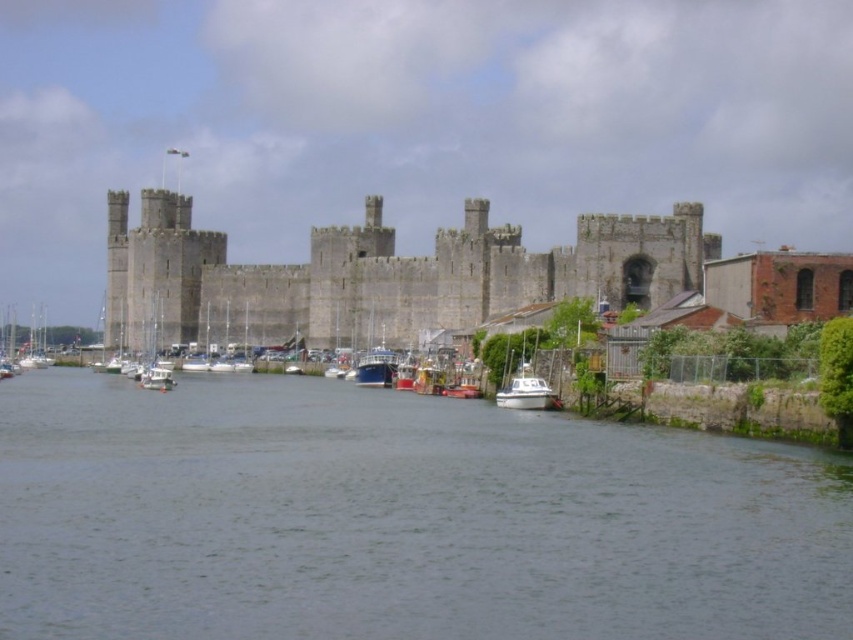
Question: Where is gray stone castle at center located in relation to white glossy boat at lower right in the image?

Choices:
 (A) right
 (B) left

Answer: (B)

Question: Can you confirm if gray stone castle at center is bigger than white glossy boat at lower right?

Choices:
 (A) no
 (B) yes

Answer: (B)

Question: Can you confirm if gray stone castle at center is positioned below white glossy boat at lower right?

Choices:
 (A) yes
 (B) no

Answer: (B)

Question: Which point is farther from the camera taking this photo?

Choices:
 (A) (616, 465)
 (B) (370, 211)

Answer: (B)

Question: Which object appears closest to the camera in this image?

Choices:
 (A) gray stone castle at center
 (B) white matte sailboat at left
 (C) white glossy boat at lower right

Answer: (C)

Question: Estimate the real-world distances between objects in this image. Which object is farther from the gray stone castle at center?

Choices:
 (A) gray concrete water at lower center
 (B) white glossy boat at lower right

Answer: (B)